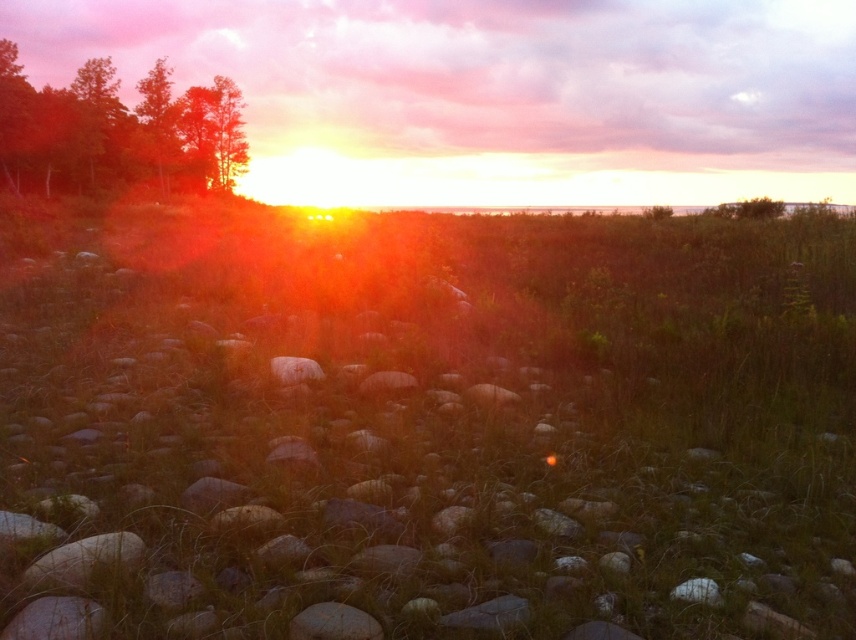
Which is more to the left, green grass at center or green matte trees at left?

From the viewer's perspective, green matte trees at left appears more on the left side.

Does green grass at center lie in front of green matte trees at left?

Yes, green grass at center is in front of green matte trees at left.

What do you see at coordinates (426, 426) in the screenshot?
I see `green grass at center` at bounding box center [426, 426].

Where is `green grass at center`? The height and width of the screenshot is (640, 856). green grass at center is located at coordinates (426, 426).